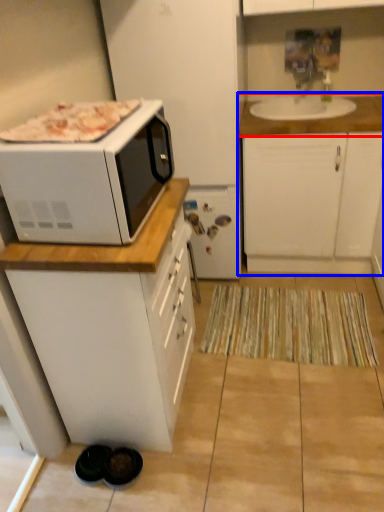
Question: Which object is closer to the camera taking this photo, countertop (highlighted by a red box) or cabinetry (highlighted by a blue box)?

Choices:
 (A) countertop
 (B) cabinetry

Answer: (B)